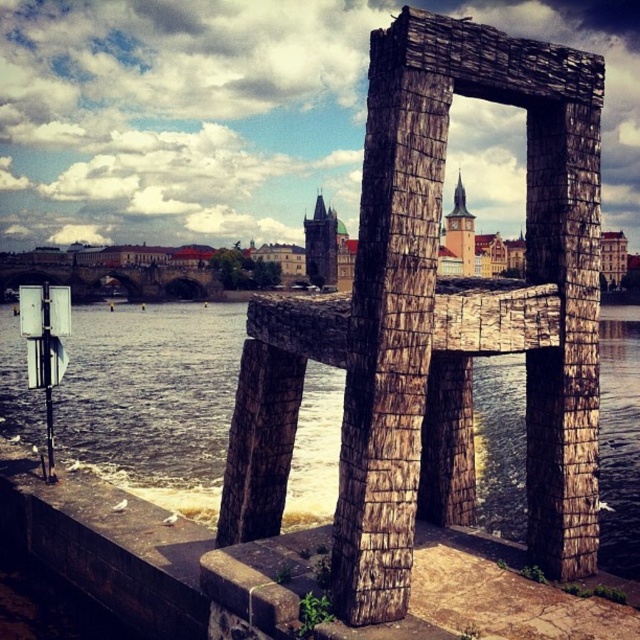
Is point (298, 355) positioned behind point (166, 340)?

No, it is in front of (166, 340).

The height and width of the screenshot is (640, 640). What do you see at coordinates (435, 316) in the screenshot?
I see `wooden chair at center` at bounding box center [435, 316].

Is point (572, 323) behind point (484, 500)?

No, (572, 323) is in front of (484, 500).

Find the location of a particular element. wooden chair at center is located at coordinates (435, 316).